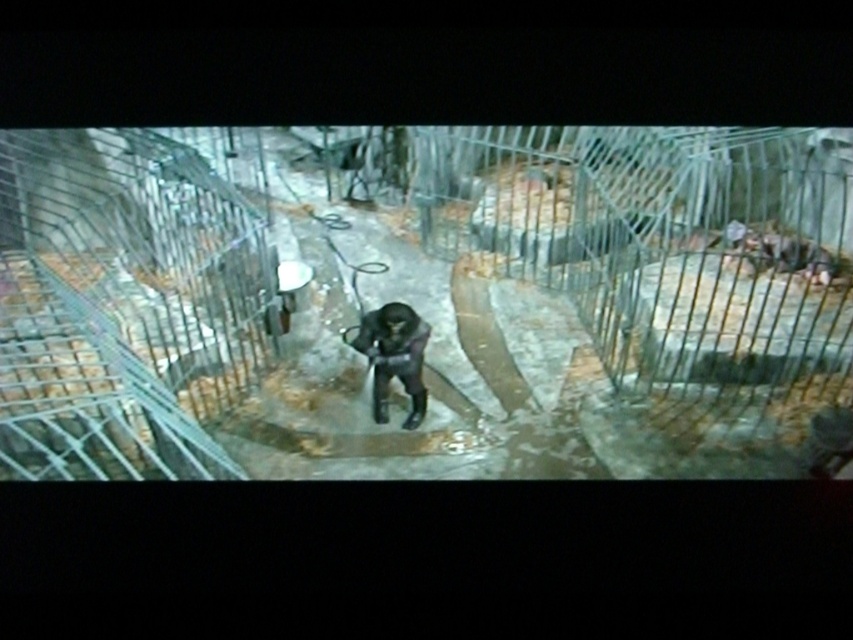
You are standing inside the enclosure and notice two points marked on the metal bars. The first point is at coordinates point (228, 269) and the second is at point (373, 362). Which point is closer to you?

Point (228, 269) is closer to you because it is further to the viewer than point (373, 362).

You are a maintenance worker standing at the entrance of the enclosure. You need to walk to the smooth concrete floor at center to perform a task. Is the floor at the center of the enclosure within your immediate vicinity?

The smooth concrete floor at center is located at point (425, 301), which is centrally positioned within the enclosure. Since you are at the entrance, the floor at the center would require you to walk towards the middle of the enclosure, so it is not immediately within your vicinity but accessible through movement.

You are a zookeeper standing outside the enclosure. You need to place a new feeding tray on the smooth concrete floor at center. However, there is a black matte gorilla at center nearby. Where should you position the feeding tray so it is accessible to the gorilla but not directly under the metal bars?

The smooth concrete floor at center is in front of the black matte gorilla at center, so placing the feeding tray on the smooth concrete floor at center would position it in front of the gorilla, making it easily accessible without being under the metal bars.